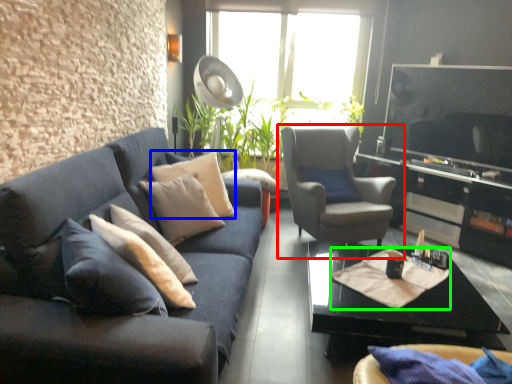
Question: Based on their relative distances, which object is nearer to chair (highlighted by a red box)? Choose from pillow (highlighted by a blue box) and material (highlighted by a green box).

Choices:
 (A) pillow
 (B) material

Answer: (B)